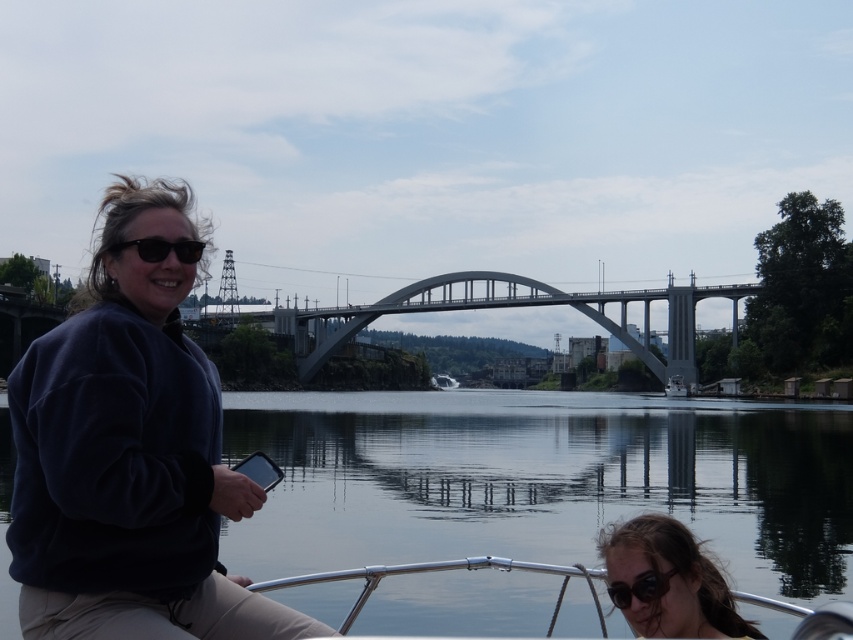
You are a photographer trying to capture a photo of the concrete bridge at center and the dark brown hair at lower right. Based on their positions, which object should you focus on first to ensure both are in the frame?

The concrete bridge at center is positioned on the left side of dark brown hair at lower right, so you should focus on the dark brown hair at lower right first to ensure both are in the frame.

You are standing at the riverside and want to reach the point marked as point (758, 637). If your maximum walking distance is 100 meters, can you reach it without exceeding your limit?

The point (758, 637) is 103.43 meters away from the viewer. Since your maximum walking distance is 100 meters, you cannot reach it without exceeding your limit.

You are a photographer trying to capture a photo of the dark brown hair at lower right and the black matte sunglasses at upper left. Which object should you focus on first if you want to ensure both are in focus without adjusting the camera settings?

The dark brown hair at lower right has a greater height compared to the black matte sunglasses at upper left, so focusing on the dark brown hair at lower right first will help ensure both are in focus since it is taller and likely closer to the camera.